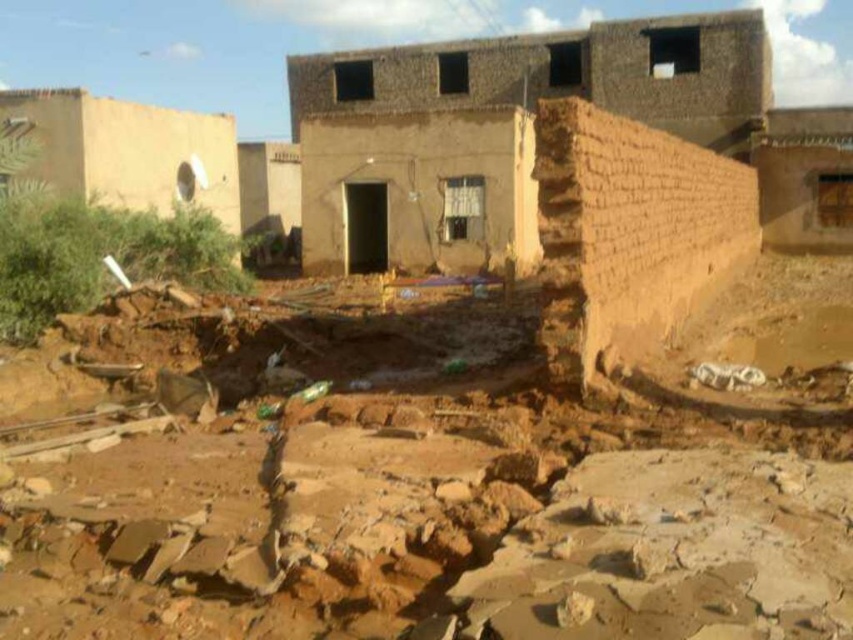
Question: Observing the image, what is the correct spatial positioning of brown clay mud at center in reference to brown mud-brick house at center?

Choices:
 (A) right
 (B) left

Answer: (A)

Question: From the image, what is the correct spatial relationship of brown clay mud at center in relation to brown mud-brick house at center?

Choices:
 (A) above
 (B) below

Answer: (B)

Question: Is brown clay mud at center positioned in front of brown mud-brick house at center?

Choices:
 (A) yes
 (B) no

Answer: (A)

Question: Among these points, which one is farthest from the camera?

Choices:
 (A) (650, 67)
 (B) (235, 422)

Answer: (A)